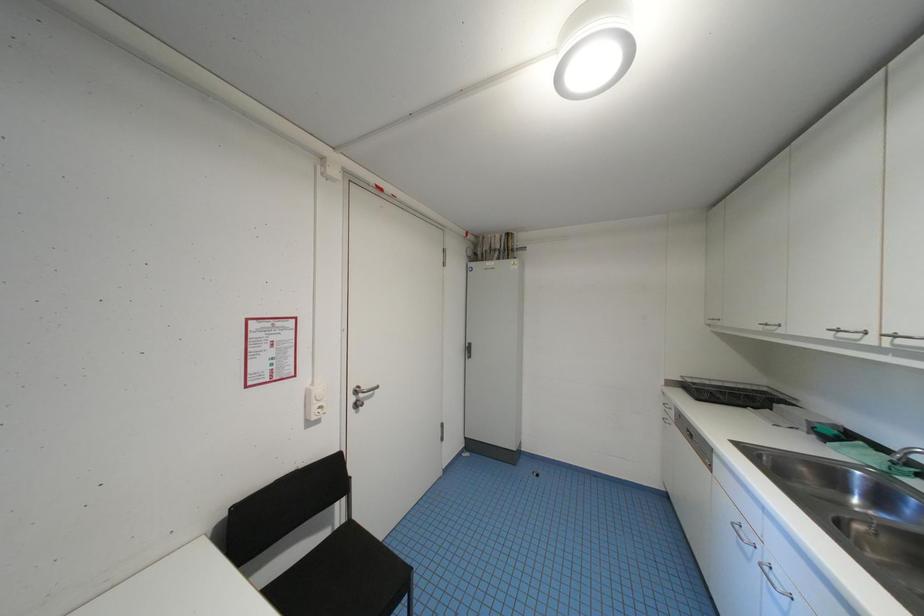
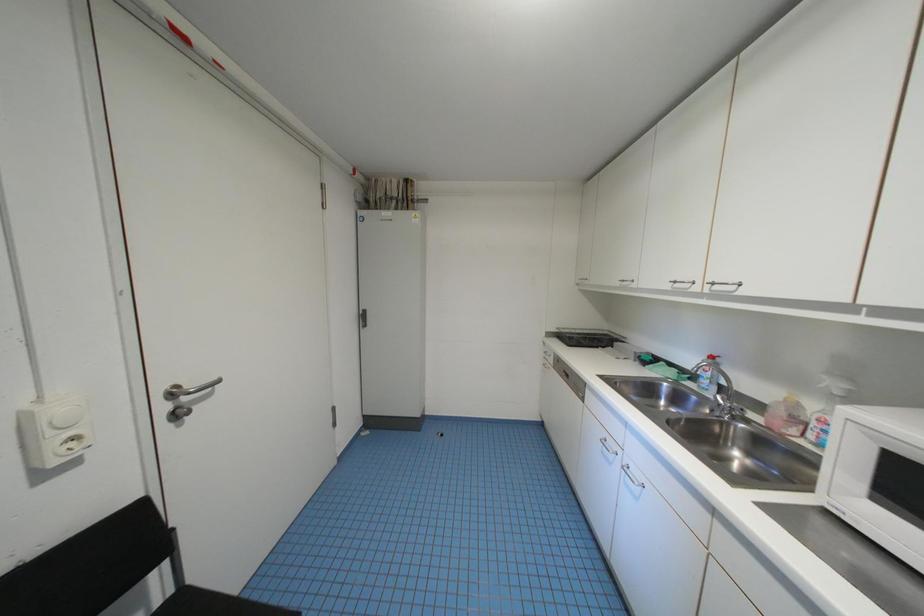
Question: The images are taken continuously from a first-person perspective. In which direction are you moving?

Choices:
 (A) Left
 (B) Right
 (C) Forward
 (D) Backward

Answer: (C)